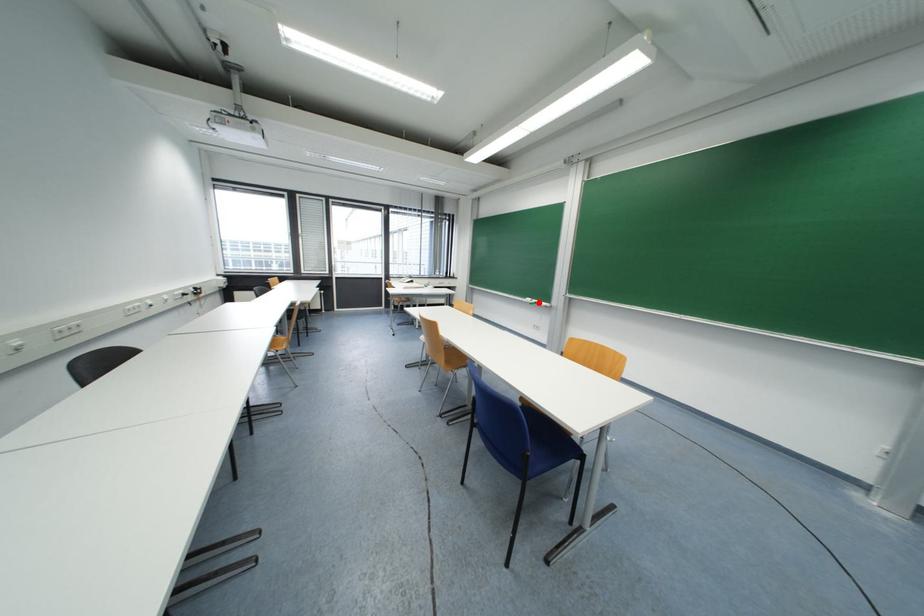
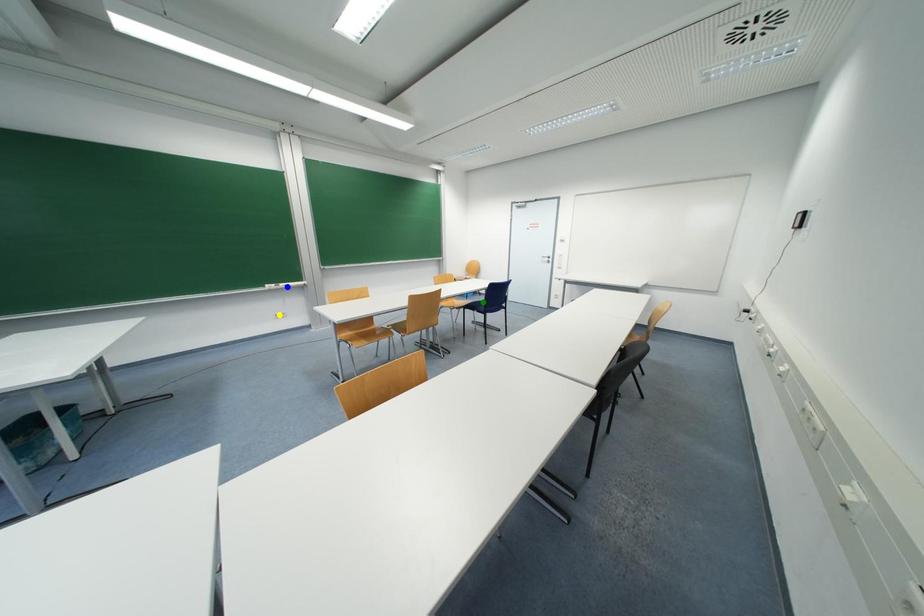
Question: I am providing you with two images of the same scene from different viewpoints. A red point is marked on the first image. You are given multiple points on the second image. Which mark in image 2 goes with the point in image 1?

Choices:
 (A) blue point
 (B) yellow point
 (C) green point

Answer: (A)